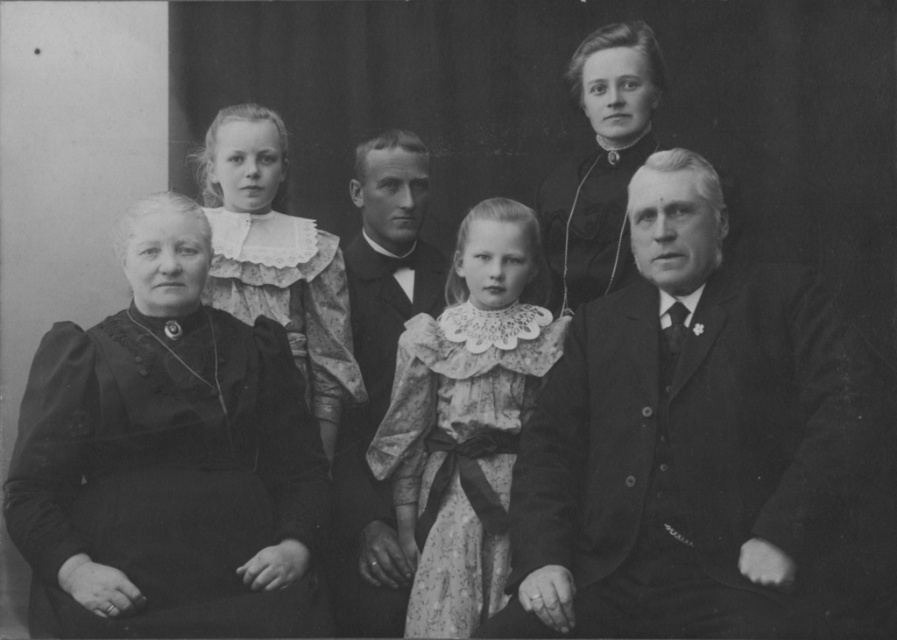
You are a photographer adjusting the lighting for this family portrait. You need to ensure that both the smooth black suit at right and the smooth black suit at center are evenly lit. Given their distance apart, can you position a single light source so that both suits receive equal illumination without creating harsh shadows?

The smooth black suit at right and smooth black suit at center are 3.54 feet apart. To evenly illuminate both suits with a single light source, position it directly between them at a distance that allows the light to cover both areas equally, ensuring soft, even lighting without harsh shadows.

In the family portrait, there are two dresses visible in the foreground. The first is a floral lace dress at center, and the second is a matte black dress at upper center. Which of these two dresses is bigger in size?

The floral lace dress at center is larger in size than the matte black dress at upper center.

Looking at this image, you are an assistant asked to identify the location of a specific point in the image. The point is located at coordinates [686,442]. Which object does this point belong to?

The point at coordinates [686,442] is on the smooth black suit at right.